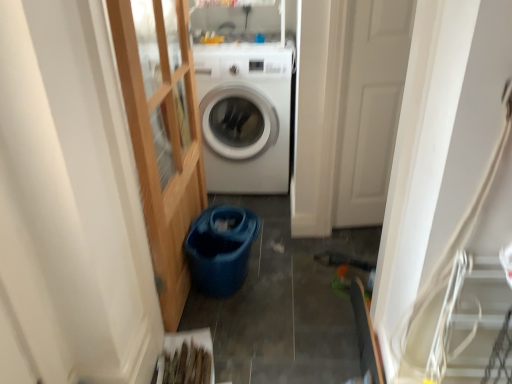
Question: Does clear glass door at left have a smaller size compared to white matte door at center?

Choices:
 (A) no
 (B) yes

Answer: (A)

Question: Is white matte door at center at the back of clear glass door at left?

Choices:
 (A) yes
 (B) no

Answer: (B)

Question: Is clear glass door at left positioned in front of white matte door at center?

Choices:
 (A) no
 (B) yes

Answer: (B)

Question: Can you confirm if clear glass door at left is bigger than white matte door at center?

Choices:
 (A) yes
 (B) no

Answer: (A)

Question: Can you confirm if clear glass door at left is positioned to the right of white matte door at center?

Choices:
 (A) yes
 (B) no

Answer: (B)

Question: Based on their positions, is clear glass door at left located to the left or right of white matte door at center?

Choices:
 (A) right
 (B) left

Answer: (B)

Question: In the image, is clear glass door at left positioned in front of or behind white matte door at center?

Choices:
 (A) behind
 (B) front

Answer: (B)

Question: From the image's perspective, is clear glass door at left above or below white matte door at center?

Choices:
 (A) above
 (B) below

Answer: (B)

Question: From a real-world perspective, relative to white matte door at center, is clear glass door at left vertically above or below?

Choices:
 (A) above
 (B) below

Answer: (A)

Question: From a real-world perspective, is white matte door at center positioned above or below white glossy washing machine at center?

Choices:
 (A) below
 (B) above

Answer: (B)

Question: From their relative heights in the image, would you say white matte door at center is taller or shorter than white glossy washing machine at center?

Choices:
 (A) tall
 (B) short

Answer: (A)

Question: Choose the correct answer: Is white matte door at center inside white glossy washing machine at center or outside it?

Choices:
 (A) inside
 (B) outside

Answer: (B)

Question: In the image, is white matte door at center positioned in front of or behind white glossy washing machine at center?

Choices:
 (A) behind
 (B) front

Answer: (B)

Question: From the image's perspective, is white matte door at center above or below clear glass door at left?

Choices:
 (A) below
 (B) above

Answer: (B)

Question: In terms of size, does white matte door at center appear bigger or smaller than clear glass door at left?

Choices:
 (A) small
 (B) big

Answer: (A)